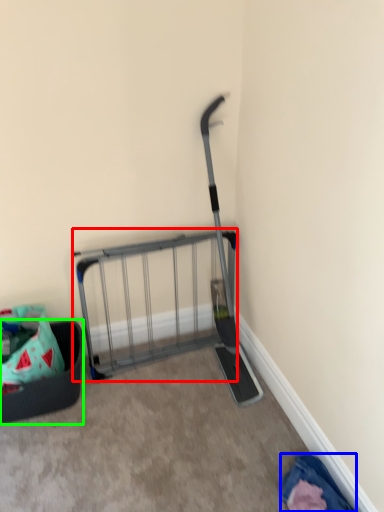
Question: Estimate the real-world distances between objects in this image. Which object is farther from cart (highlighted by a red box), clothing (highlighted by a blue box) or furniture (highlighted by a green box)?

Choices:
 (A) clothing
 (B) furniture

Answer: (A)